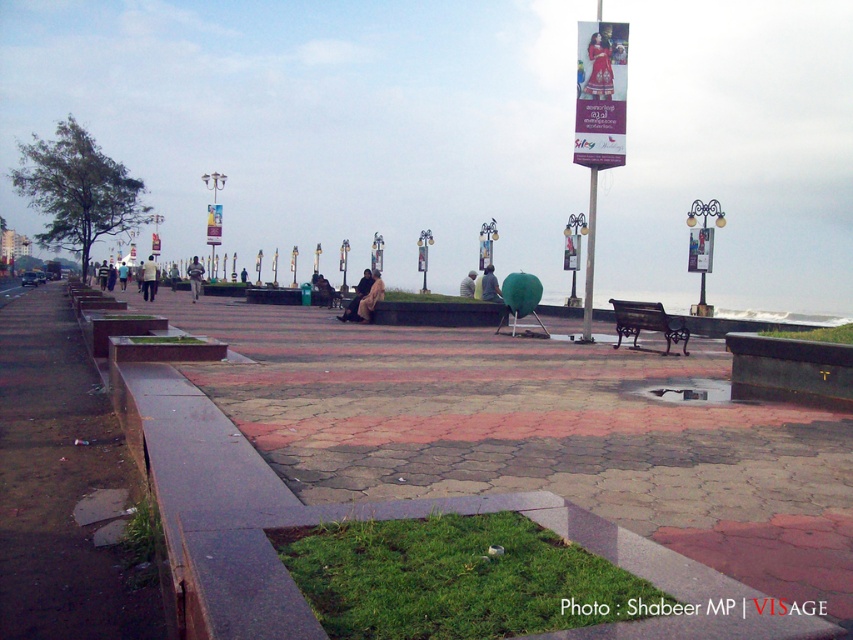
You are a photographer wanting to capture both the matte red dress at upper center and the striped fabric person at center in the same frame. Which object should you focus on first to ensure both are in the frame?

Since the matte red dress at upper center is thinner than the striped fabric person at center, you should focus on the striped fabric person at center first to ensure both are in the frame.

You are a photographer trying to capture a group photo of people on the promenade. You notice the light yellow shirt at left and the light brown fabric person at center. Which one would you need to position closer to the camera to ensure they appear the same size in the photo?

The light yellow shirt at left occupies less space than the light brown fabric person at center, so you would need to position the light yellow shirt at left closer to the camera to make them appear the same size.